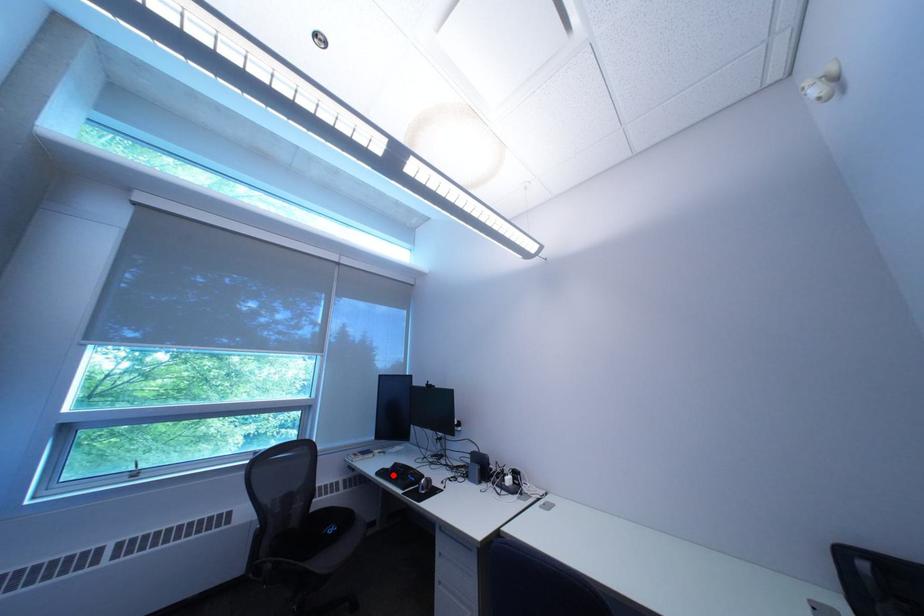
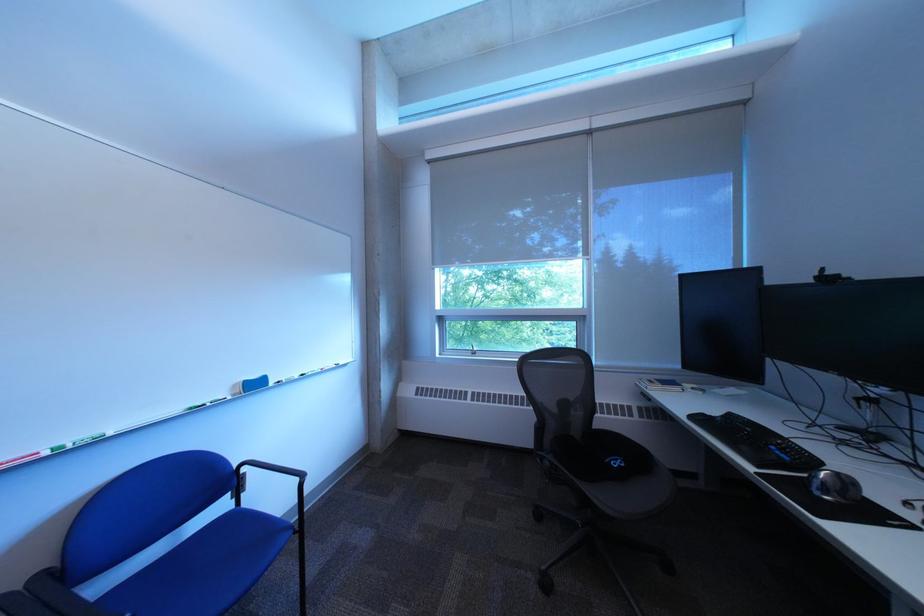
Find the pixel in the second image that matches the highlighted location in the first image.

(708, 419)